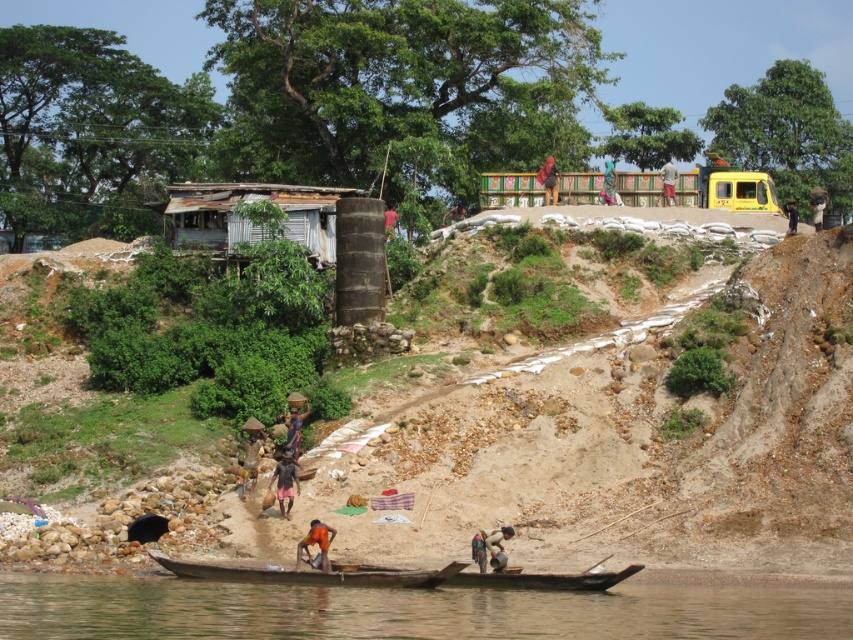
You are standing at the riverside and want to reach both points marked on the image. Which point, point (263,228) or point (822,204), is closer to you?

Point (263,228) is closer to you than point (822,204).

You are standing at the point where the yellow vehicle is parked. Looking towards the rusty wood hut at center left located at point (251, 220), what direction should you face to see the boat in the river?

The rusty wood hut at center left is located at point (251, 220). Since the boat is in the river in the foreground, facing towards the river from the yellow vehicle would allow you to see the boat. Therefore, you should face towards the river, which is in front of the rusty wood hut at center left.